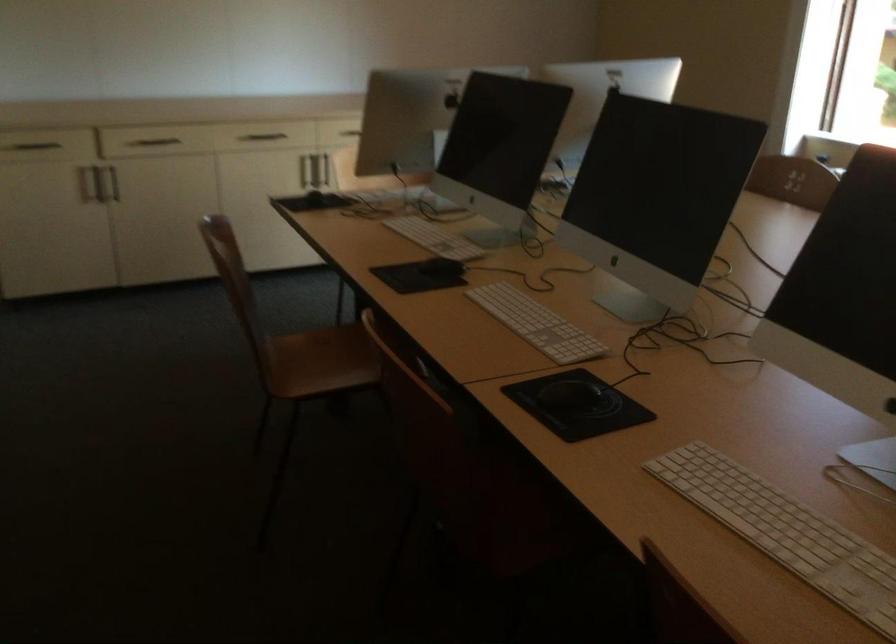
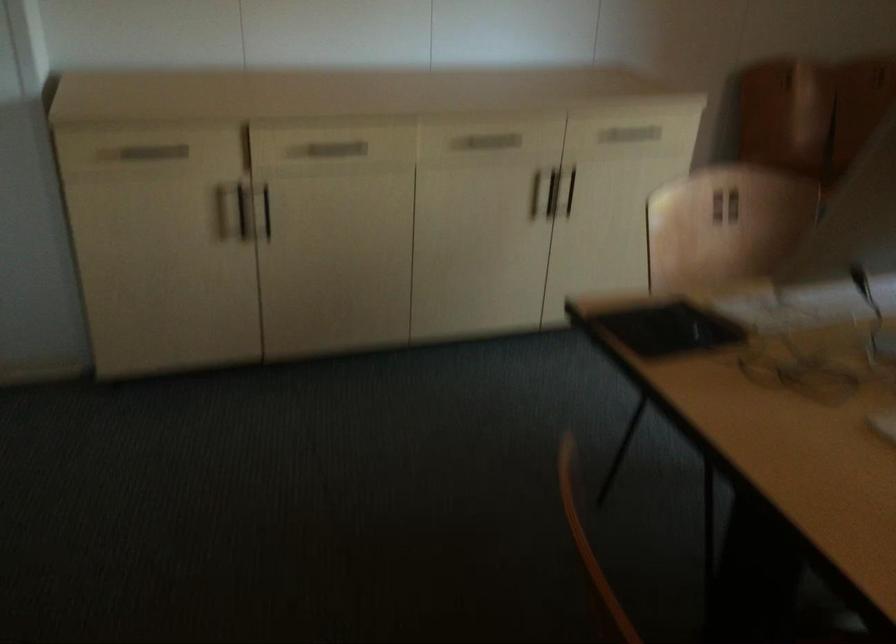
In the second image, find the point that corresponds to the point at 107,176 in the first image.

(264, 211)